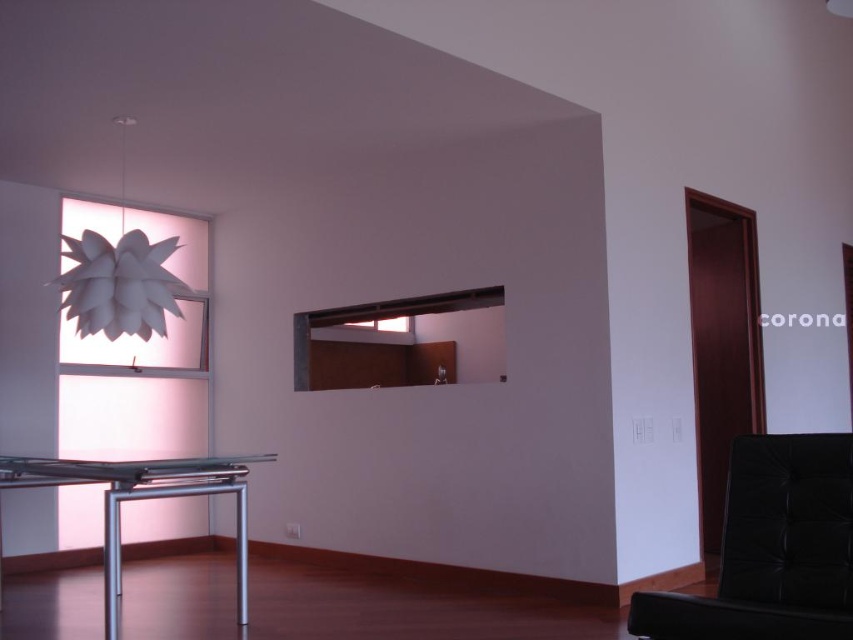
You are a visitor in this room and want to place a tall plant on the silver metallic table at lower left. However, you are concerned about the height of the white paper lamp at upper left. Will the lamp be visible above the plant if you place it there?

The silver metallic table at lower left has a greater height compared to the white paper lamp at upper left. Therefore, placing the tall plant on the silver metallic table at lower left will likely block the view of the white paper lamp at upper left since the table is taller than the lamp.

You are arranging a small plant on the silver metallic table at lower left and want to hang the white paper lamp at upper left above it. Considering their widths, will the lamp fit directly above the table without overhanging the edges?

The silver metallic table at lower left is wider than the white paper lamp at upper left. Since the table is wider, the lamp will fit directly above it without overhanging the edges.